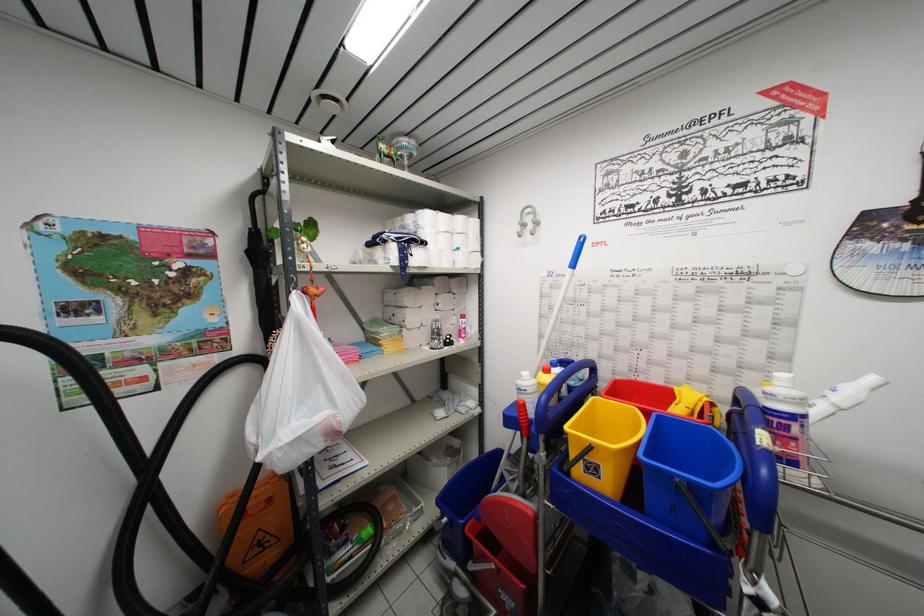
Describe the element at coordinates (603, 444) in the screenshot. The height and width of the screenshot is (616, 924). I see `a yellow bucket handle` at that location.